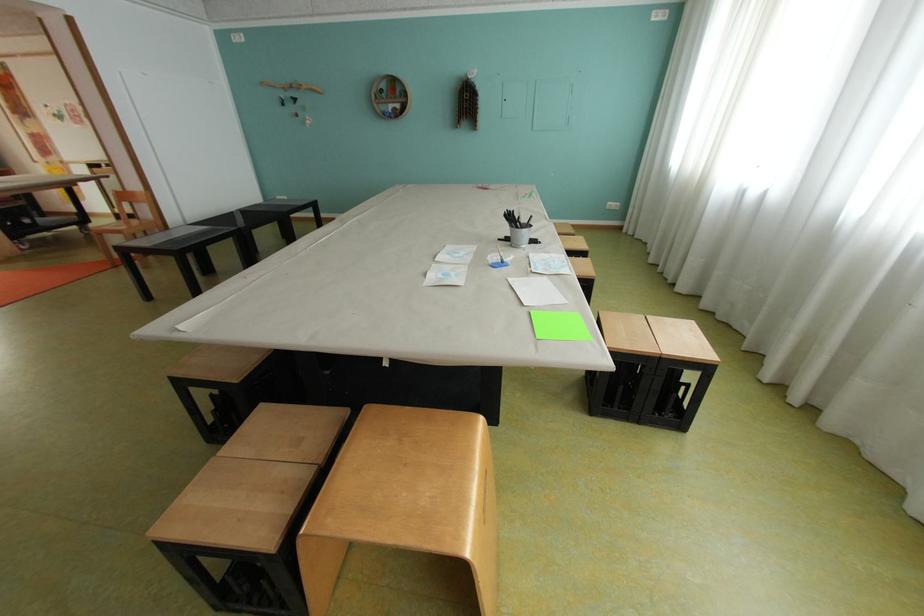
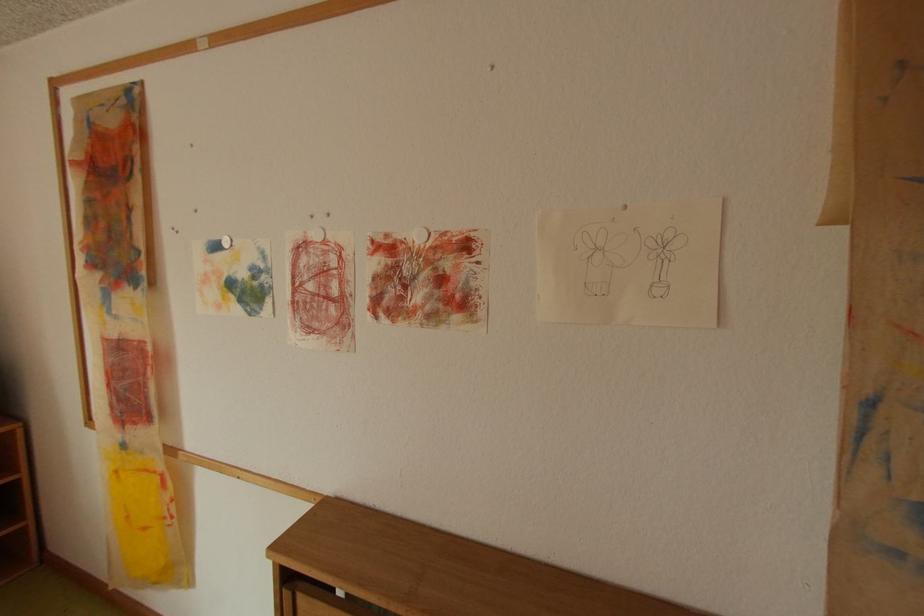
The point at (56,107) is marked in the first image. Where is the corresponding point in the second image?

(225, 246)